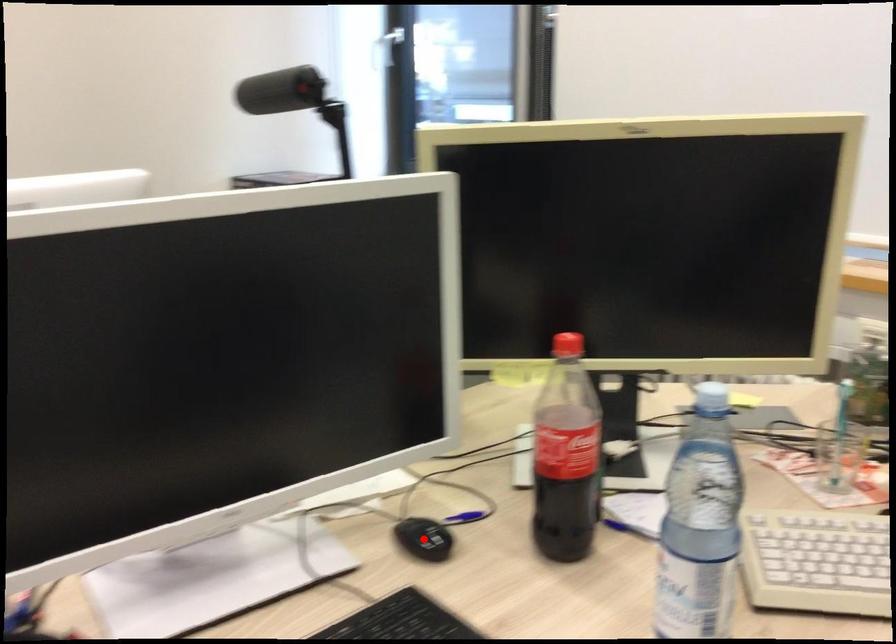
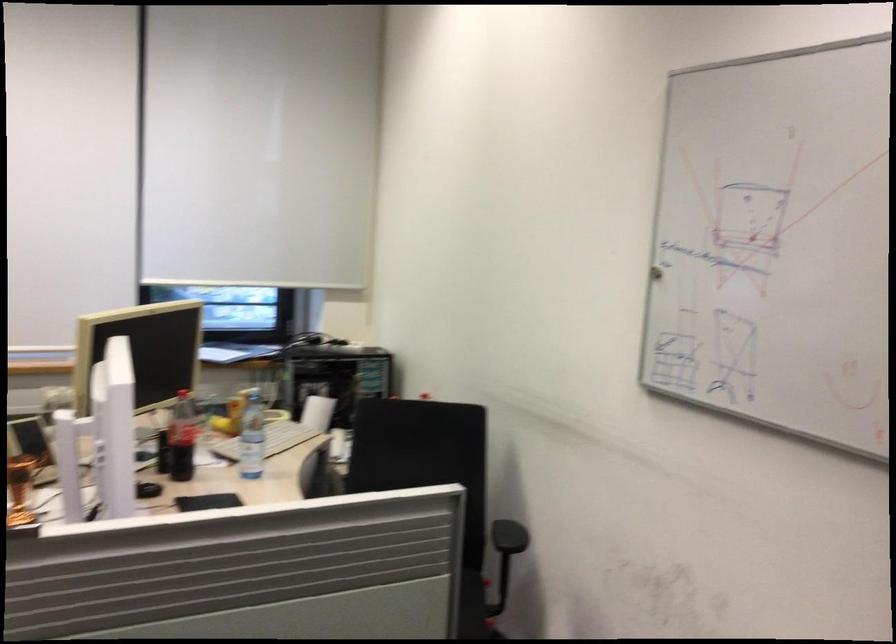
Question: I am providing you with two images of the same scene from different viewpoints. A red point is marked on the first image. Can you still see the location of the red point in image 2?

Choices:
 (A) Yes
 (B) No

Answer: (B)